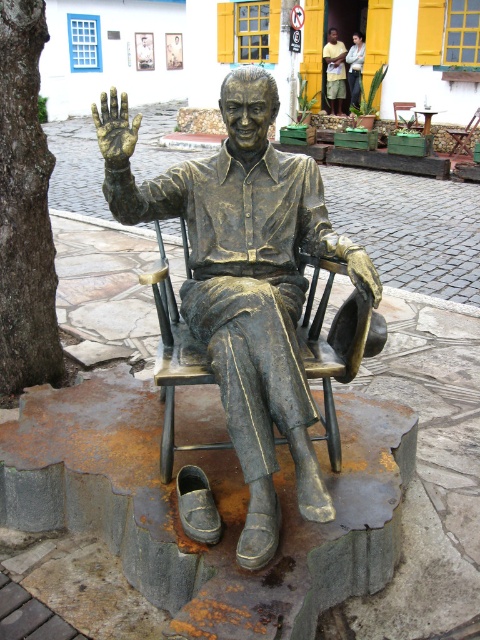
Does bronze statue at center have a lesser height compared to gold metallic hand at center?

Incorrect, bronze statue at center's height does not fall short of gold metallic hand at center's.

Which is behind, point (289, 234) or point (95, 115)?

The point (289, 234) is more distant.

Find the location of a particular element. This screenshot has height=640, width=480. bronze statue at center is located at coordinates (252, 289).

Locate an element on the screen. The height and width of the screenshot is (640, 480). bronze statue at center is located at coordinates (x=252, y=289).

Locate an element on the screen. The image size is (480, 640). gold metallic hand at center is located at coordinates (115, 129).

Can you confirm if gold metallic hand at center is shorter than light brown wood statue at center?

Yes, gold metallic hand at center is shorter than light brown wood statue at center.

I want to click on gold metallic hand at center, so click(x=115, y=129).

Is bronze statue at center closer to camera compared to bronze textured rocking chair at center?

Yes, bronze statue at center is closer to the viewer.

Is bronze statue at center thinner than bronze textured rocking chair at center?

No.

At what (x,y) coordinates should I click in order to perform the action: click on bronze statue at center. Please return your answer as a coordinate pair (x, y). Image resolution: width=480 pixels, height=640 pixels. Looking at the image, I should click on (252, 289).